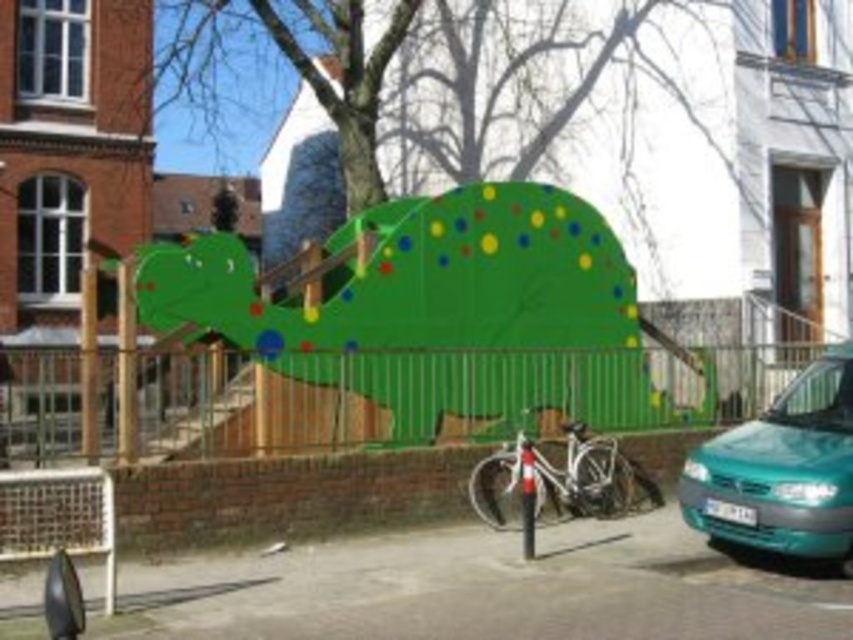
Question: Among these points, which one is nearest to the camera?

Choices:
 (A) (509, 490)
 (B) (318, 248)

Answer: (A)

Question: Which is nearer to the white metallic bicycle at center?

Choices:
 (A) green matte climbing wall at center
 (B) teal glossy van at lower right

Answer: (B)

Question: Which object is closer to the camera taking this photo?

Choices:
 (A) green matte climbing wall at center
 (B) teal glossy van at lower right

Answer: (B)

Question: In this image, where is teal glossy van at lower right located relative to white metallic bicycle at center?

Choices:
 (A) below
 (B) above

Answer: (B)

Question: Is green matte climbing wall at center positioned before teal glossy van at lower right?

Choices:
 (A) no
 (B) yes

Answer: (A)

Question: Does green matte climbing wall at center have a lesser width compared to white metallic bicycle at center?

Choices:
 (A) no
 (B) yes

Answer: (B)